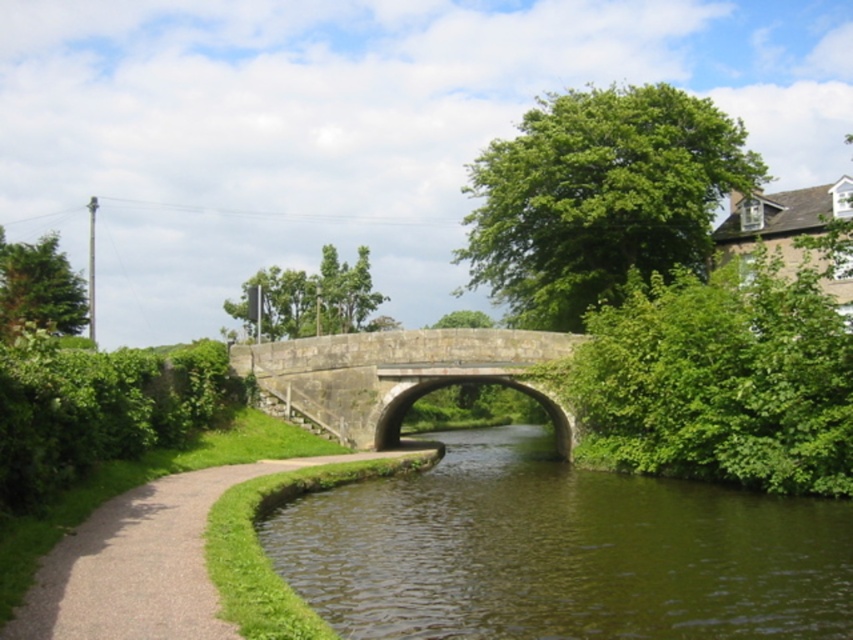
You are a tourist standing on the paved path on the left side of the image. You want to take a photo of the stone bridge at center and the green smooth water at center. Which object should you focus on first if you want to capture both in a single frame without moving your camera?

The stone bridge at center is closer to you than the green smooth water at center, so you should focus on the stone bridge at center first to ensure both are in focus.